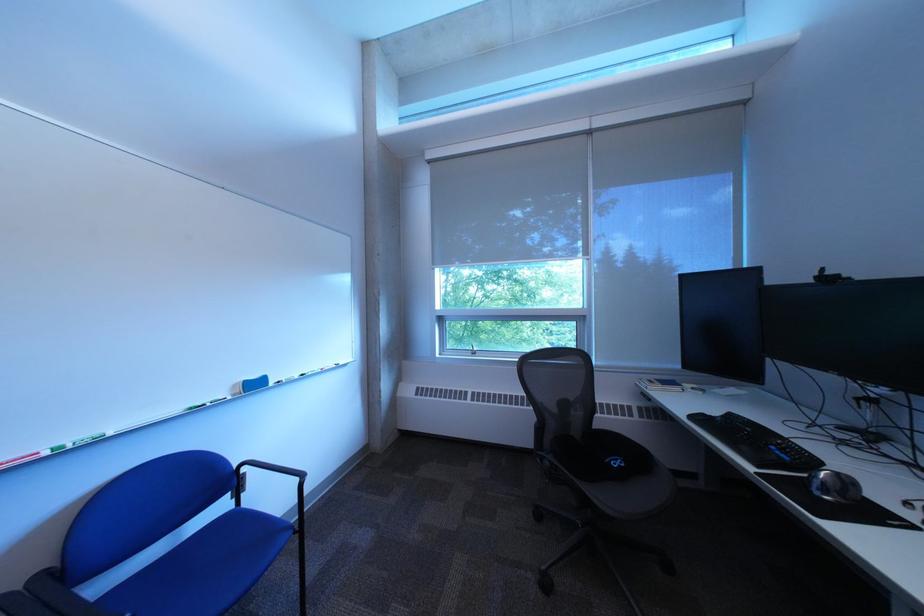
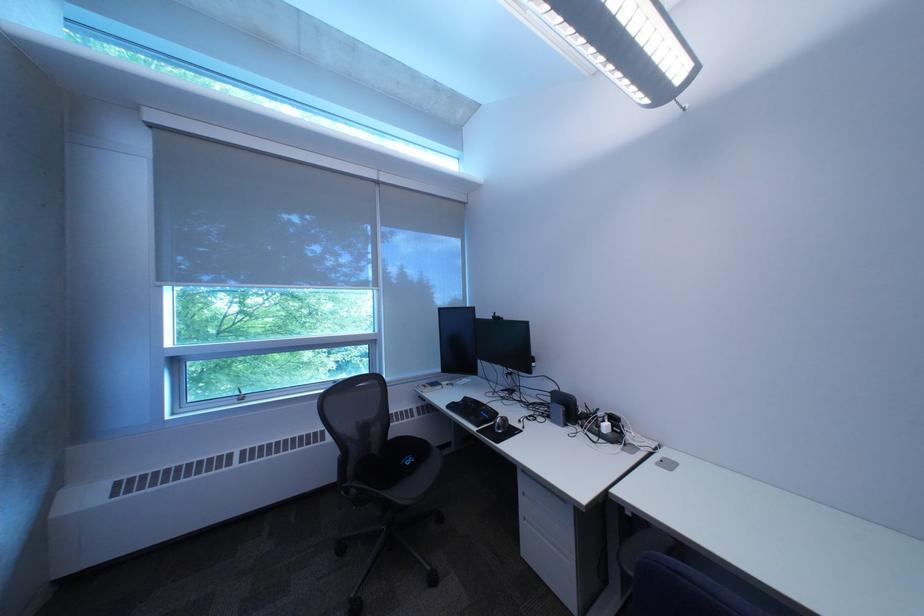
The point at (x=708, y=419) is marked in the first image. Where is the corresponding point in the second image?

(464, 408)